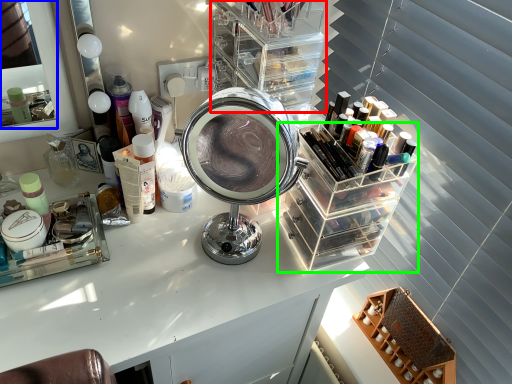
Question: Estimate the real-world distances between objects in this image. Which object is closer to shelf (highlighted by a red box), mirror (highlighted by a blue box) or glass box (highlighted by a green box)?

Choices:
 (A) mirror
 (B) glass box

Answer: (B)